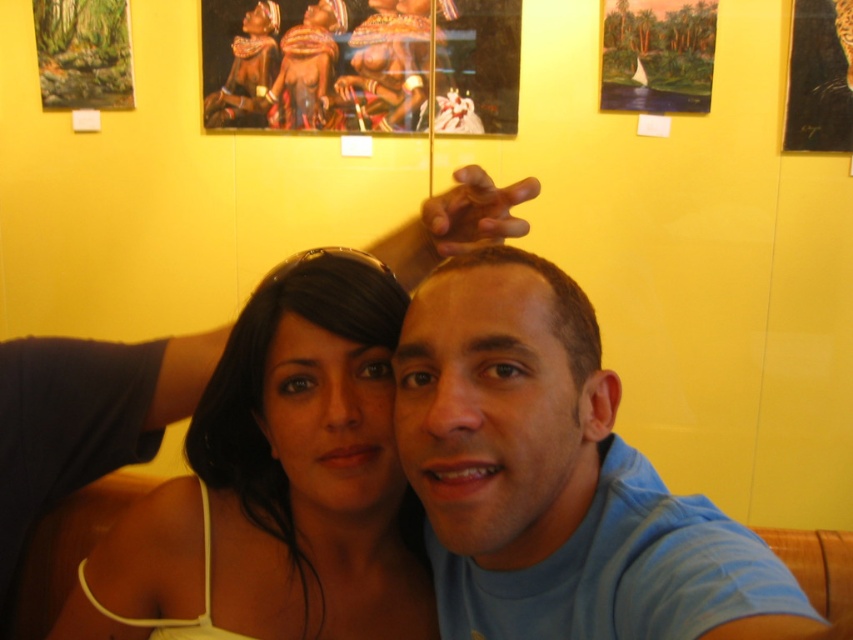
You are a photographer at an art gallery. You need to arrange two people wearing the blue cotton shirt at center and the matte white tank top at center for a photo. According to the scene, which clothing item should be placed to the right to match the original composition?

The blue cotton shirt at center should be placed to the right of the matte white tank top at center to match the original composition.

You are standing in an art gallery and see the matte wooden frame at upper left and the brown matte hair at center in the image. Which object is positioned to the left of the other?

The matte wooden frame at upper left is to the left of the brown matte hair at center.

You are a photographer at an art gallery. You need to decide which clothing item to feature in a catalog. The blue cotton shirt at center and the matte white tank top at center are both candidates. Based on their sizes, which one would you choose if you want to highlight a larger piece of clothing?

The blue cotton shirt at center is bigger than the matte white tank top at center, so you should choose the blue cotton shirt at center to highlight a larger piece of clothing.